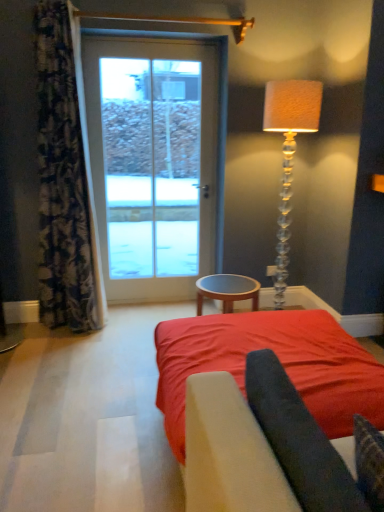
Question: In terms of width, does red fabric bed at center look wider or thinner when compared to brown wooden table at center?

Choices:
 (A) thin
 (B) wide

Answer: (B)

Question: Is red fabric bed at center in front of or behind brown wooden table at center in the image?

Choices:
 (A) front
 (B) behind

Answer: (A)

Question: Which is nearer to the white glass door at center?

Choices:
 (A) dark fabric at center
 (B) red fabric bed at center
 (C) floral fabric curtain at left
 (D) brown wooden table at center
 (E) translucent glass floor lamp at right

Answer: (C)

Question: Considering the real-world distances, which object is closest to the floral fabric curtain at left?

Choices:
 (A) translucent glass floor lamp at right
 (B) white glass door at center
 (C) red fabric bed at center
 (D) dark fabric at center
 (E) brown wooden table at center

Answer: (B)